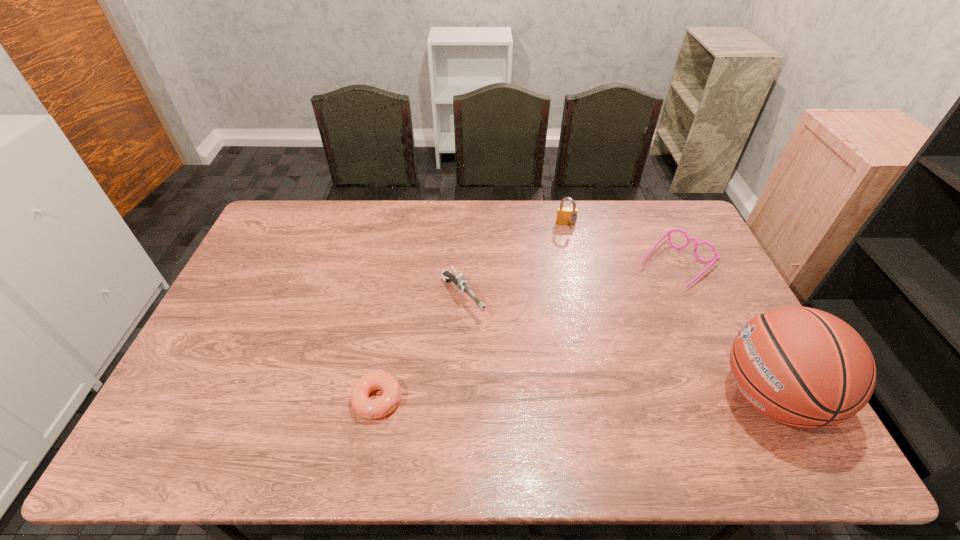
Image resolution: width=960 pixels, height=540 pixels. Identify the location of vacant space at the near edge of the desktop. (407, 417).

The height and width of the screenshot is (540, 960). In order to click on vacant space at the left edge of the desktop in this screenshot , I will do `click(253, 293)`.

Identify the location of vacant space at the right edge. (733, 333).

At what (x,y) coordinates should I click in order to perform the action: click on free space at the far left corner of the desktop. Please return your answer as a coordinate pair (x, y). Looking at the image, I should click on (276, 211).

Locate an element on the screen. free space at the far right corner of the desktop is located at coordinates (674, 207).

You are a GUI agent. You are given a task and a screenshot of the screen. Output one action in this format:
    pyautogui.click(x=<x>, y=<y>)
    Task: Click on the vacant space at the near right corner
    The height and width of the screenshot is (540, 960).
    Given the screenshot: What is the action you would take?
    pyautogui.click(x=737, y=418)

The width and height of the screenshot is (960, 540). Identify the location of vacant space in between the shortest object and the third tallest object. (420, 349).

Where is `unoccupied position between the tallest object and the third tallest object`? unoccupied position between the tallest object and the third tallest object is located at coordinates (617, 348).

Image resolution: width=960 pixels, height=540 pixels. I want to click on free spot between the second tallest object and the gun, so click(x=515, y=262).

Where is `free space between the third tallest object and the second tallest object`? free space between the third tallest object and the second tallest object is located at coordinates (515, 262).